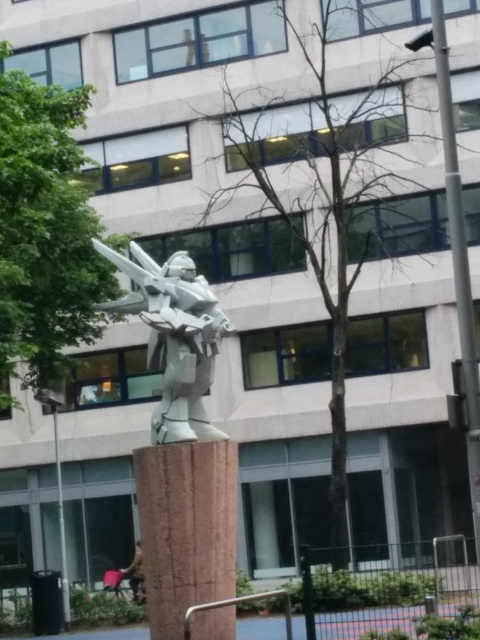
You are a bird looking for a place to perch. You see the bare branches at center and the metallic pole at center. Which one is shorter and better for landing?

The bare branches at center are shorter than the metallic pole at center, so they are better for landing.

You are an art curator planning to display both the white matte sculpture at center and the brown fabric bag at lower center in a gallery. Given their sizes, which object should be placed on a taller stand to ensure proper visibility?

The white matte sculpture at center is larger in size than the brown fabric bag at lower center, so it should be placed on a taller stand to ensure proper visibility.